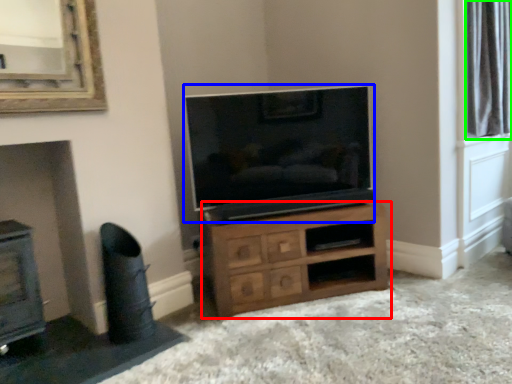
Question: Which is farther away from chest of drawers (highlighted by a red box)? television (highlighted by a blue box) or bay window (highlighted by a green box)?

Choices:
 (A) television
 (B) bay window

Answer: (B)